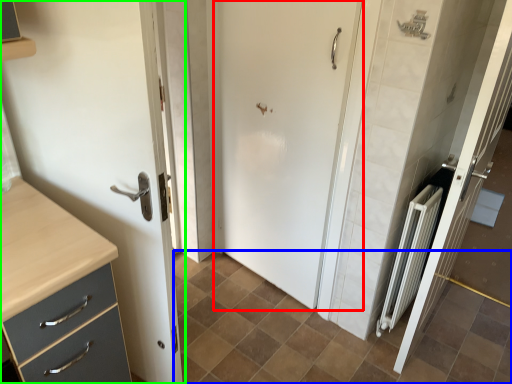
Question: Which is nearer to the door (highlighted by a red box)? ceramic tile (highlighted by a blue box) or door (highlighted by a green box).

Choices:
 (A) ceramic tile
 (B) door

Answer: (A)